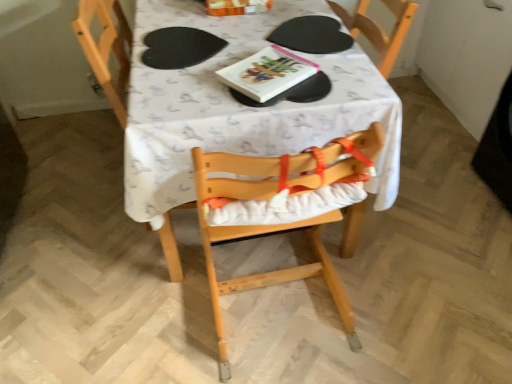
Locate an element on the screen. This screenshot has width=512, height=384. vacant area that lies to the right of hardcover book at center is located at coordinates 351,77.